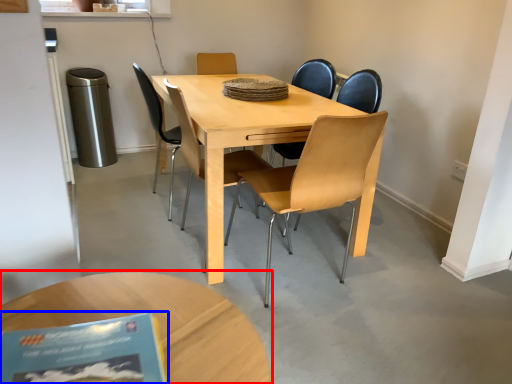
Question: Which point is closer to the camera, coffee table (highlighted by a red box) or book (highlighted by a blue box)?

Choices:
 (A) coffee table
 (B) book

Answer: (B)